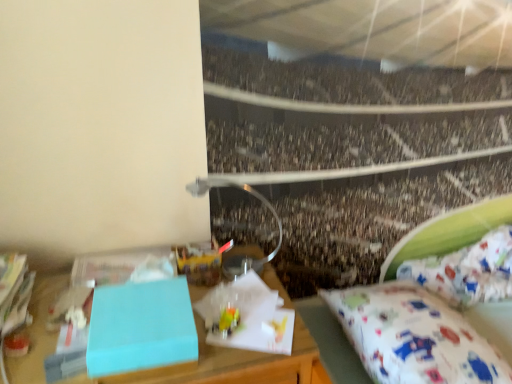
Question: Considering the relative positions of matte blue box at center and white fabric mattress at lower right in the image provided, is matte blue box at center to the left of white fabric mattress at lower right from the viewer's perspective?

Choices:
 (A) yes
 (B) no

Answer: (A)

Question: From the image's perspective, is matte blue box at center beneath white fabric mattress at lower right?

Choices:
 (A) yes
 (B) no

Answer: (A)

Question: Does matte blue box at center have a greater width compared to white fabric mattress at lower right?

Choices:
 (A) no
 (B) yes

Answer: (B)

Question: Can white fabric mattress at lower right be found inside matte blue box at center?

Choices:
 (A) yes
 (B) no

Answer: (B)

Question: Does matte blue box at center have a larger size compared to white fabric mattress at lower right?

Choices:
 (A) yes
 (B) no

Answer: (A)

Question: Is matte blue box at center taller than white fabric mattress at lower right?

Choices:
 (A) yes
 (B) no

Answer: (A)

Question: Is white fabric mattress at lower right far from speckled concrete crowd at center?

Choices:
 (A) yes
 (B) no

Answer: (B)

Question: From the image's perspective, is white fabric mattress at lower right located beneath speckled concrete crowd at center?

Choices:
 (A) yes
 (B) no

Answer: (A)

Question: Does white fabric mattress at lower right contain speckled concrete crowd at center?

Choices:
 (A) no
 (B) yes

Answer: (A)

Question: Is the depth of white fabric mattress at lower right greater than that of speckled concrete crowd at center?

Choices:
 (A) no
 (B) yes

Answer: (A)

Question: Is white fabric mattress at lower right thinner than speckled concrete crowd at center?

Choices:
 (A) yes
 (B) no

Answer: (B)

Question: Is white fabric mattress at lower right positioned in front of speckled concrete crowd at center?

Choices:
 (A) no
 (B) yes

Answer: (B)

Question: From the image's perspective, is speckled concrete crowd at center above light blue matte box at left?

Choices:
 (A) no
 (B) yes

Answer: (B)